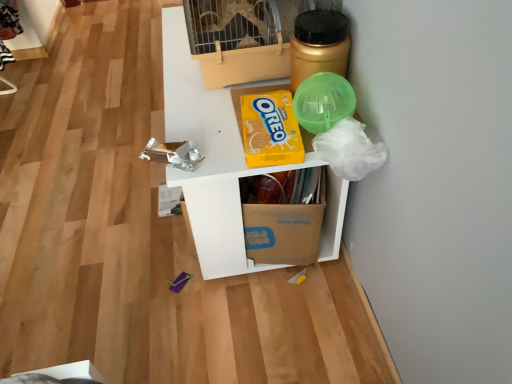
Question: In the image, is beige plastic birdcage at upper center on the left side or the right side of gold metallic jar at upper right?

Choices:
 (A) left
 (B) right

Answer: (A)

Question: Is point (186, 4) closer or farther from the camera than point (345, 46)?

Choices:
 (A) farther
 (B) closer

Answer: (A)

Question: Which object is the closest to the beige plastic birdcage at upper center?

Choices:
 (A) white cardboard box at upper center
 (B) yellow cardboard oreo at upper center
 (C) brown cardboard box at center
 (D) gold metallic jar at upper right

Answer: (D)

Question: Based on their relative distances, which object is farther from the gold metallic jar at upper right?

Choices:
 (A) yellow cardboard oreo at upper center
 (B) white cardboard box at upper center
 (C) beige plastic birdcage at upper center
 (D) brown cardboard box at center

Answer: (D)